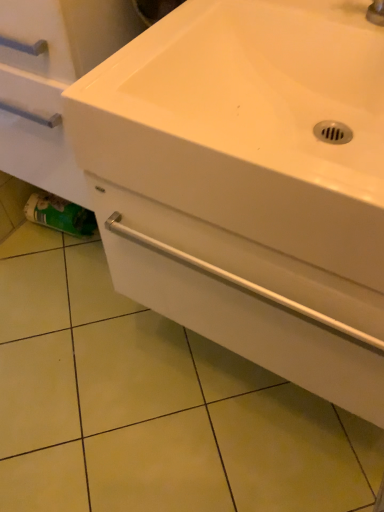
Question: Choose the correct answer: Is white glossy sink at center inside green matte toilet paper at lower left or outside it?

Choices:
 (A) inside
 (B) outside

Answer: (B)

Question: From the image's perspective, is white glossy sink at center positioned above or below green matte toilet paper at lower left?

Choices:
 (A) below
 (B) above

Answer: (B)

Question: Which is nearer to the white glossy drawer at center?

Choices:
 (A) white glossy sink at center
 (B) green matte toilet paper at lower left

Answer: (A)

Question: Estimate the real-world distances between objects in this image. Which object is closer to the green matte toilet paper at lower left?

Choices:
 (A) white glossy sink at center
 (B) white glossy drawer at center

Answer: (B)